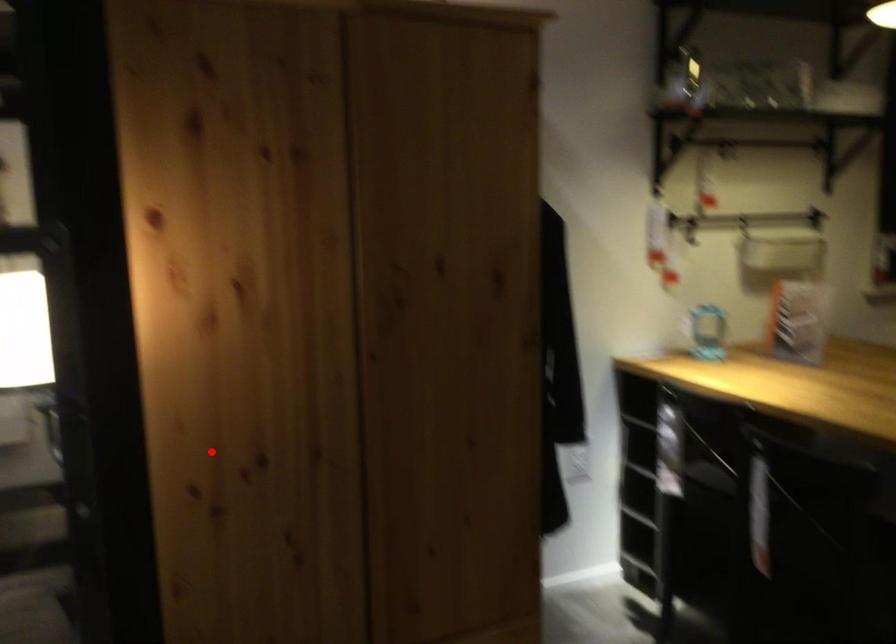
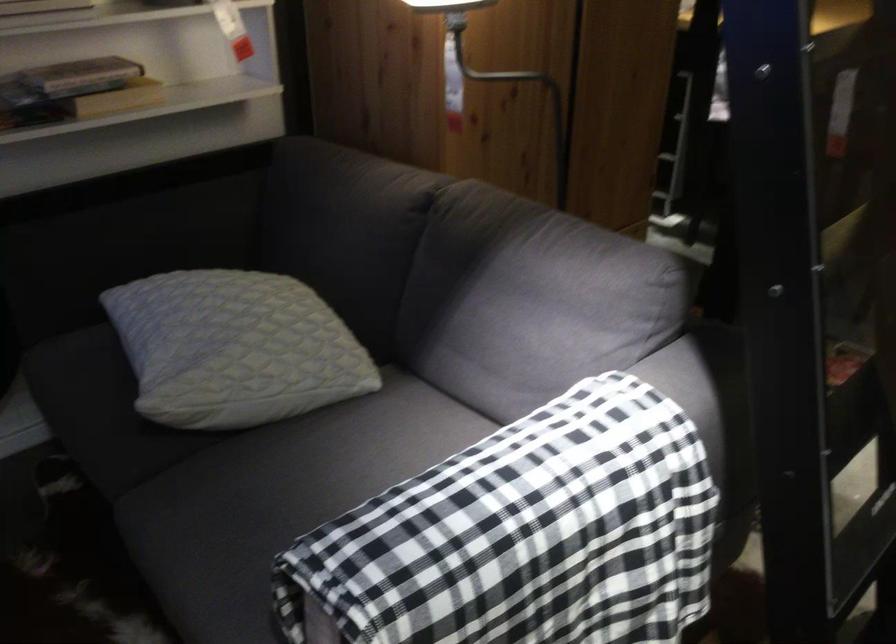
Locate, in the second image, the point that corresponds to the highlighted location in the first image.

(500, 71)